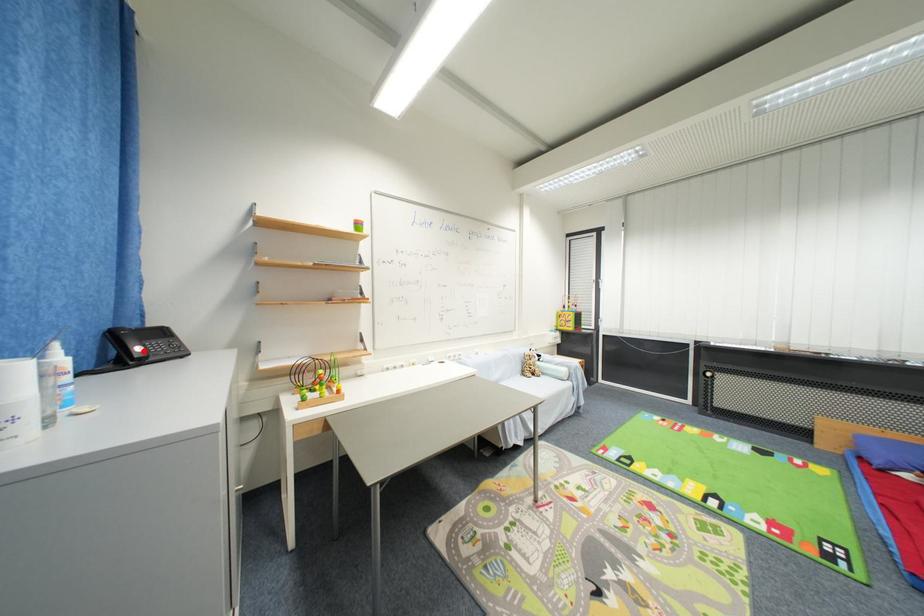
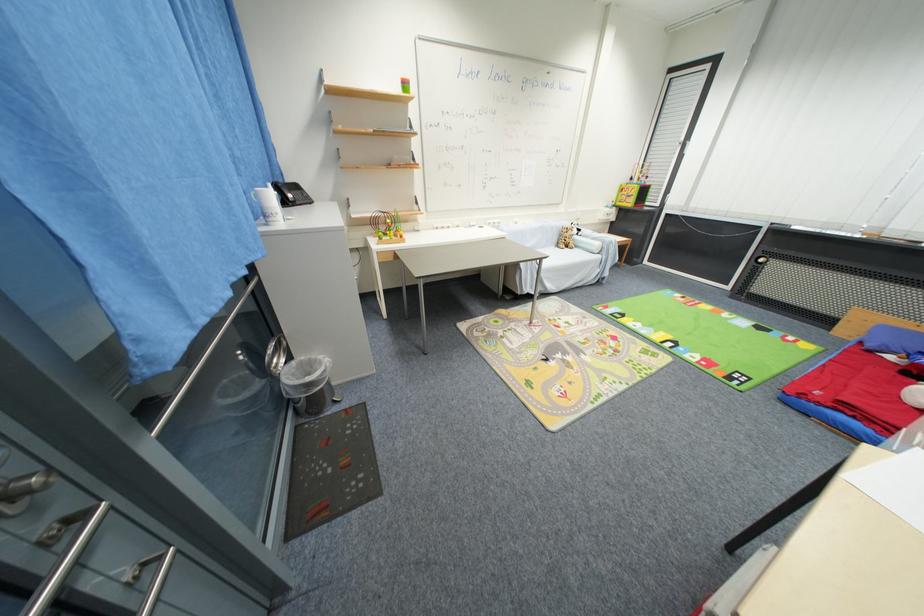
Locate, in the second image, the point that corresponds to the highlighted location in the first image.

(296, 198)